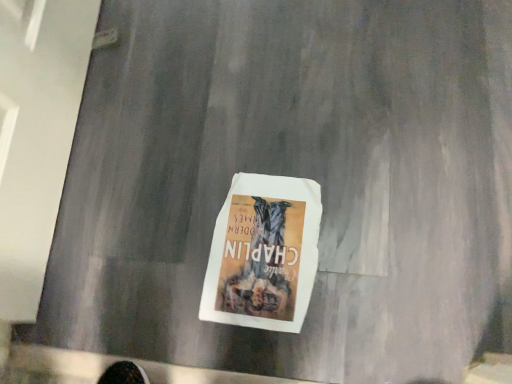
The image size is (512, 384). What are the coordinates of `blank area beneath white paper at center (from a real-world perspective)` in the screenshot? It's located at (261, 249).